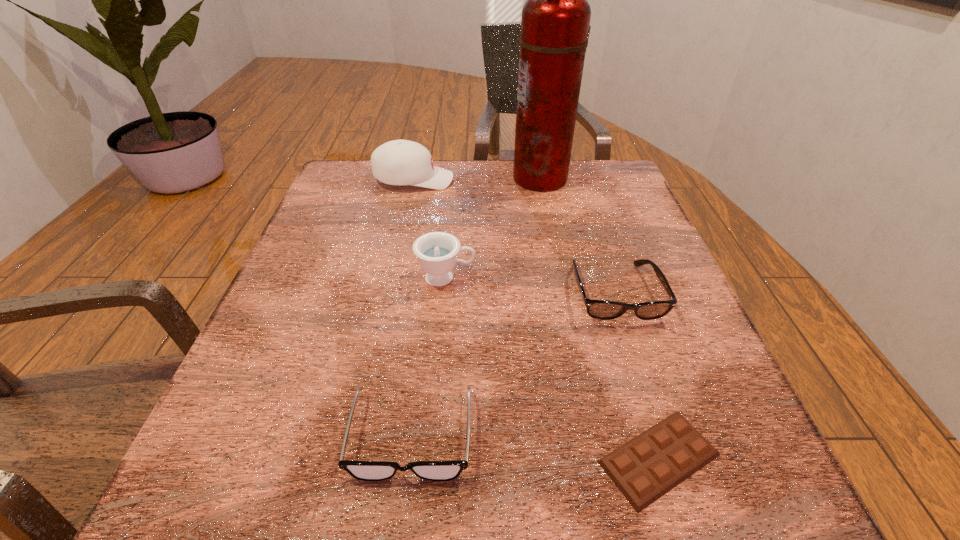
Identify the location of free space located on the nozzle side of the fire extinguisher. (364, 178).

This screenshot has height=540, width=960. I want to click on vacant space positioned on the front-facing side of the baseball cap, so click(587, 180).

In order to click on vacant space located 0.160m on the side of the teacup with the handle in this screenshot , I will do `click(559, 278)`.

Image resolution: width=960 pixels, height=540 pixels. Identify the location of free space located on the lenses of the farther spectacles. (634, 352).

Find the location of `vacant region located 0.050m on the front-facing side of the nearer spectacles`. vacant region located 0.050m on the front-facing side of the nearer spectacles is located at coordinates (400, 526).

This screenshot has height=540, width=960. I want to click on free location located on the back of the shortest object, so click(604, 281).

Where is `fire extinguisher at the far edge`? fire extinguisher at the far edge is located at coordinates (555, 21).

Locate an element on the screen. The width and height of the screenshot is (960, 540). baseball cap located in the far edge section of the desktop is located at coordinates (399, 162).

Locate an element on the screen. spectacles present at the near edge is located at coordinates (361, 470).

The width and height of the screenshot is (960, 540). Find the location of `chocolate bar positioned at the near edge`. chocolate bar positioned at the near edge is located at coordinates (645, 468).